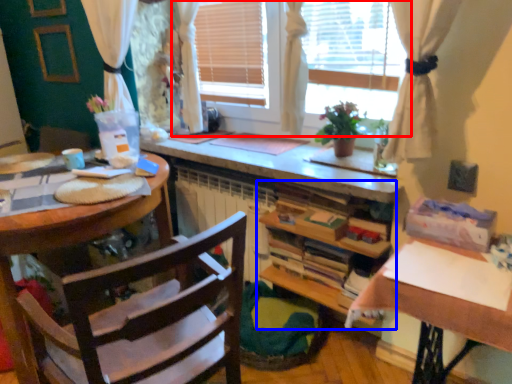
Question: Which point is closer to the camera, window (highlighted by a red box) or cabinetry (highlighted by a blue box)?

Choices:
 (A) window
 (B) cabinetry

Answer: (A)